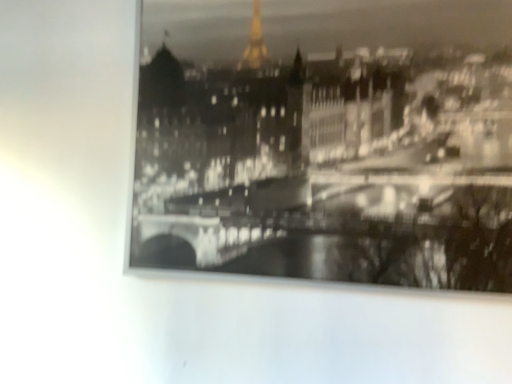
You are a GUI agent. You are given a task and a screenshot of the screen. Output one action in this format:
    pyautogui.click(x=<x>, y=<y>)
    Task: Click on the black paper at upper center
    This screenshot has width=512, height=384.
    Given the screenshot: What is the action you would take?
    pyautogui.click(x=327, y=141)

The width and height of the screenshot is (512, 384). What do you see at coordinates (327, 141) in the screenshot? I see `black paper at upper center` at bounding box center [327, 141].

Measure the distance between point (394, 29) and camera.

Point (394, 29) is 1.24 meters from camera.

The width and height of the screenshot is (512, 384). Identify the location of black paper at upper center. (327, 141).